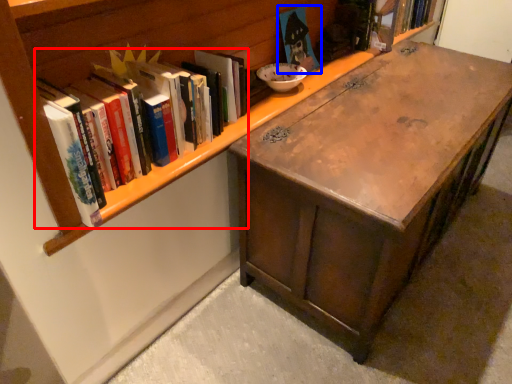
Question: Which object is closer to the camera taking this photo, book (highlighted by a red box) or book (highlighted by a blue box)?

Choices:
 (A) book
 (B) book

Answer: (A)